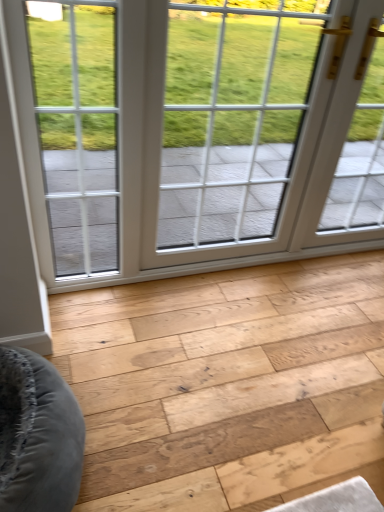
Question: Is natural wood plank at center in front of or behind white glass window at center in the image?

Choices:
 (A) behind
 (B) front

Answer: (B)

Question: From a real-world perspective, is natural wood plank at center positioned above or below white glass window at center?

Choices:
 (A) above
 (B) below

Answer: (B)

Question: Which is correct: natural wood plank at center is inside white glass window at center, or outside of it?

Choices:
 (A) outside
 (B) inside

Answer: (A)

Question: Visually, is white glass window at center positioned to the left or to the right of natural wood plank at center?

Choices:
 (A) left
 (B) right

Answer: (A)

Question: Is white glass window at center inside or outside of natural wood plank at center?

Choices:
 (A) outside
 (B) inside

Answer: (A)

Question: Is point (225, 40) positioned closer to the camera than point (221, 459)?

Choices:
 (A) farther
 (B) closer

Answer: (A)

Question: From their relative heights in the image, would you say white glass window at center is taller or shorter than natural wood plank at center?

Choices:
 (A) tall
 (B) short

Answer: (A)